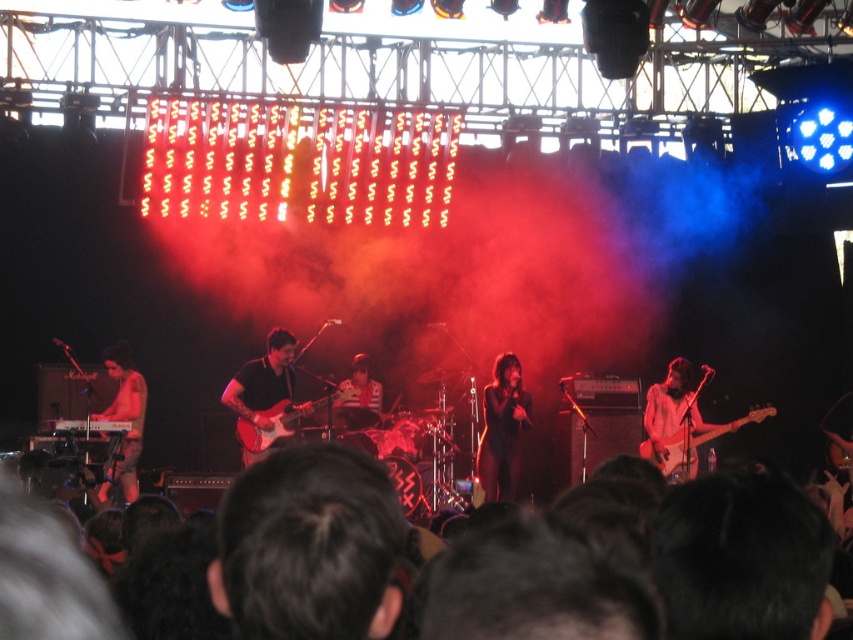
Is black matte dress at center smaller than glossy wood guitar at center?

Correct, black matte dress at center occupies less space than glossy wood guitar at center.

Who is shorter, black matte dress at center or glossy wood guitar at center?

With less height is glossy wood guitar at center.

Where is `black matte dress at center`? This screenshot has height=640, width=853. black matte dress at center is located at coordinates (502, 429).

Can you confirm if matte black guitar at center is positioned to the left of shiny metallic keyboard at lower left?

In fact, matte black guitar at center is to the right of shiny metallic keyboard at lower left.

Does matte black guitar at center lie behind shiny metallic keyboard at lower left?

No, it is in front of shiny metallic keyboard at lower left.

Between point (248, 390) and point (120, 387), which one is positioned behind?

The point (248, 390) is behind.

Find the location of `matte black guitar at center`. matte black guitar at center is located at coordinates (262, 384).

Between point (155, 586) and point (346, 394), which one is positioned behind?

The point (346, 394) is behind.

Does point (56, 566) come farther from viewer compared to point (279, 424)?

No, (56, 566) is in front of (279, 424).

Who is more distant from viewer, (41, 596) or (331, 394)?

Positioned behind is point (331, 394).

Find the location of `dark hair at lower center`. dark hair at lower center is located at coordinates (47, 577).